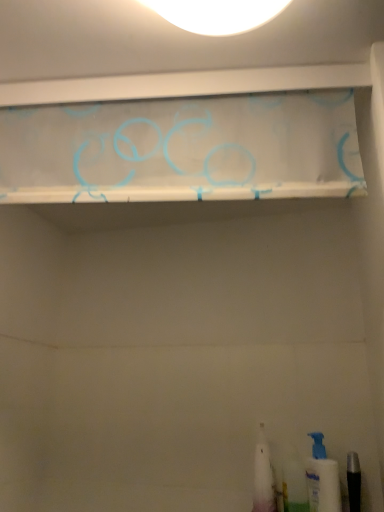
Question: In terms of height, does white plastic toothbrush at lower right, the 1th toiletry in the left-to-right sequence, look taller or shorter compared to translucent fabric curtain at upper center?

Choices:
 (A) tall
 (B) short

Answer: (A)

Question: Is white plastic toothbrush at lower right, positioned as the 3th toiletry in right-to-left order, wider or thinner than translucent fabric curtain at upper center?

Choices:
 (A) wide
 (B) thin

Answer: (A)

Question: Which object is the closest to the translucent fabric curtain at upper center?

Choices:
 (A) translucent plastic toothbrush at lower right, the second toiletry viewed from the right
 (B) white plastic toothbrush at lower right, positioned as the 3th toiletry in right-to-left order
 (C) white plastic pump bottle at lower right, the first toiletry when ordered from right to left

Answer: (B)

Question: Which of these objects is positioned closest to the translucent plastic toothbrush at lower right, the second toiletry viewed from the right?

Choices:
 (A) translucent fabric curtain at upper center
 (B) white plastic pump bottle at lower right, acting as the 3th toiletry starting from the left
 (C) white plastic toothbrush at lower right, positioned as the 3th toiletry in right-to-left order

Answer: (B)